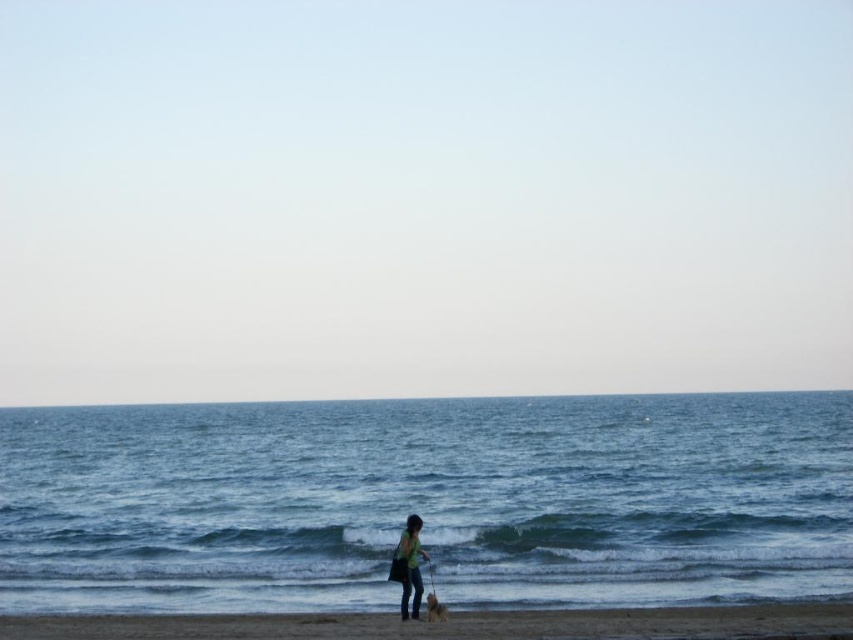
You are standing on the brown sand at lower center and want to walk to the blue water at lower center. Based on the scene description, which direction should you move to reach the water?

The blue water at lower center is much taller than the brown sand at lower center, so you should move towards the area where the water is higher, which would be in the direction of the water itself. However, since the sand is at the lower center, moving towards the water likely means walking forward towards the water.

You are a photographer trying to capture the perfect shot of the beach scene. Since you want to focus on the textures, you need to know which object has a coarser texture between the brown sand at lower center and the green fabric shirt at lower center. Which one should you focus on?

The brown sand at lower center has a larger size compared to the green fabric shirt at lower center, so focusing on the brown sand at lower center would capture a coarser texture.